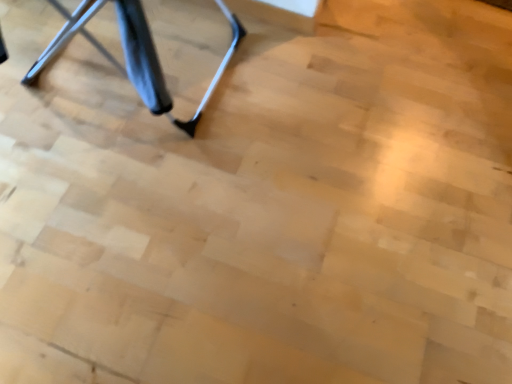
Identify the location of black rubber tripod at upper left. (135, 53).

Image resolution: width=512 pixels, height=384 pixels. What do you see at coordinates (135, 53) in the screenshot?
I see `black rubber tripod at upper left` at bounding box center [135, 53].

The image size is (512, 384). Identify the location of black rubber tripod at upper left. (135, 53).